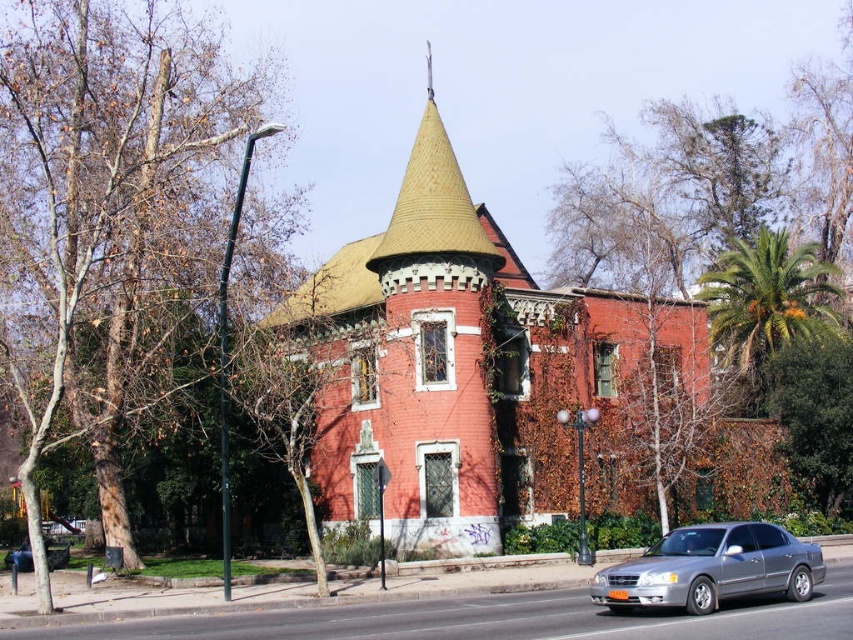
Can you confirm if silver metallic sedan at lower center is positioned to the left of yellow shingled spire at upper center?

Incorrect, silver metallic sedan at lower center is not on the left side of yellow shingled spire at upper center.

Which is in front, point (709, 552) or point (440, 172)?

Positioned in front is point (709, 552).

Describe the element at coordinates (711, 568) in the screenshot. The image size is (853, 640). I see `silver metallic sedan at lower center` at that location.

You are a GUI agent. You are given a task and a screenshot of the screen. Output one action in this format:
    pyautogui.click(x=<x>, y=<y>)
    Task: Click on the silver metallic sedan at lower center
    The width and height of the screenshot is (853, 640).
    Given the screenshot: What is the action you would take?
    pyautogui.click(x=711, y=568)

Can you confirm if yellow shingled spire at upper center is shorter than metallic silver sedan at center?

Incorrect, yellow shingled spire at upper center's height does not fall short of metallic silver sedan at center's.

Is point (427, 129) farther from viewer compared to point (21, 556)?

That is True.

Where is `yellow shingled spire at upper center`? This screenshot has height=640, width=853. yellow shingled spire at upper center is located at coordinates (433, 200).

Is silver metallic sedan at lower center positioned behind metallic silver sedan at center?

No, it is in front of metallic silver sedan at center.

Does silver metallic sedan at lower center appear on the left side of metallic silver sedan at center?

Incorrect, silver metallic sedan at lower center is not on the left side of metallic silver sedan at center.

The width and height of the screenshot is (853, 640). Find the location of `silver metallic sedan at lower center`. silver metallic sedan at lower center is located at coordinates (711, 568).